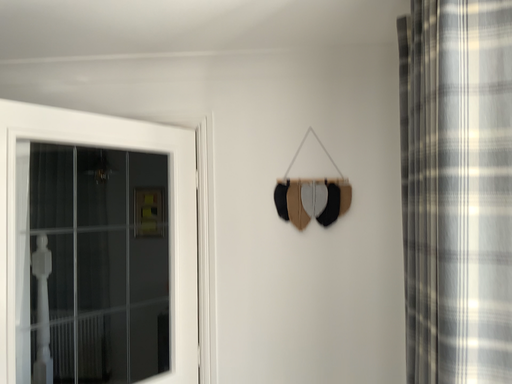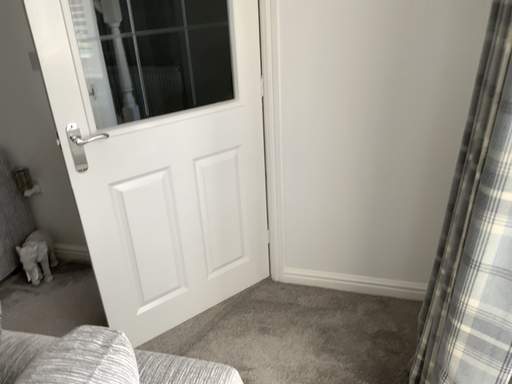
Question: How did the camera likely rotate when shooting the video?

Choices:
 (A) rotated downward
 (B) rotated upward

Answer: (A)